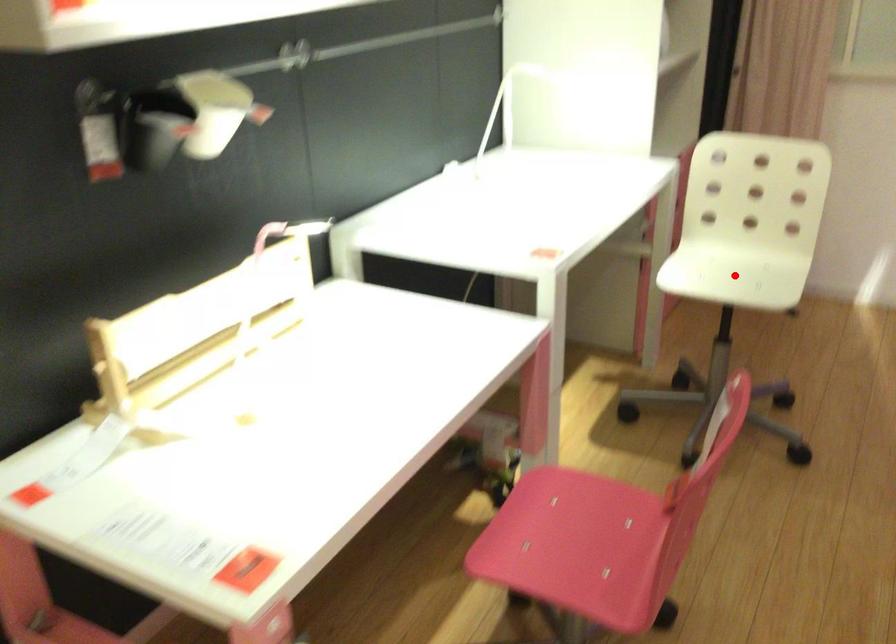
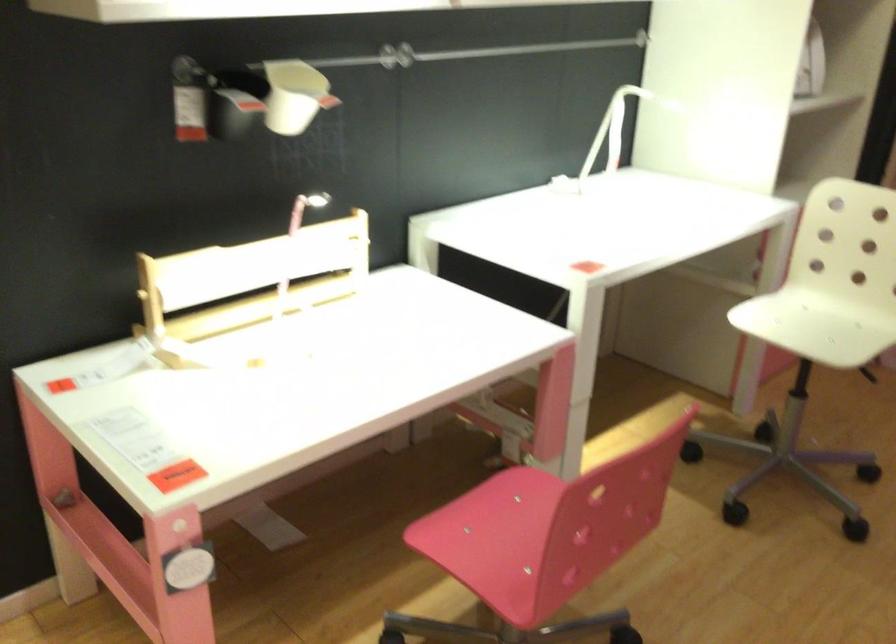
Where in the second image is the point corresponding to the highlighted location from the first image?

(812, 327)